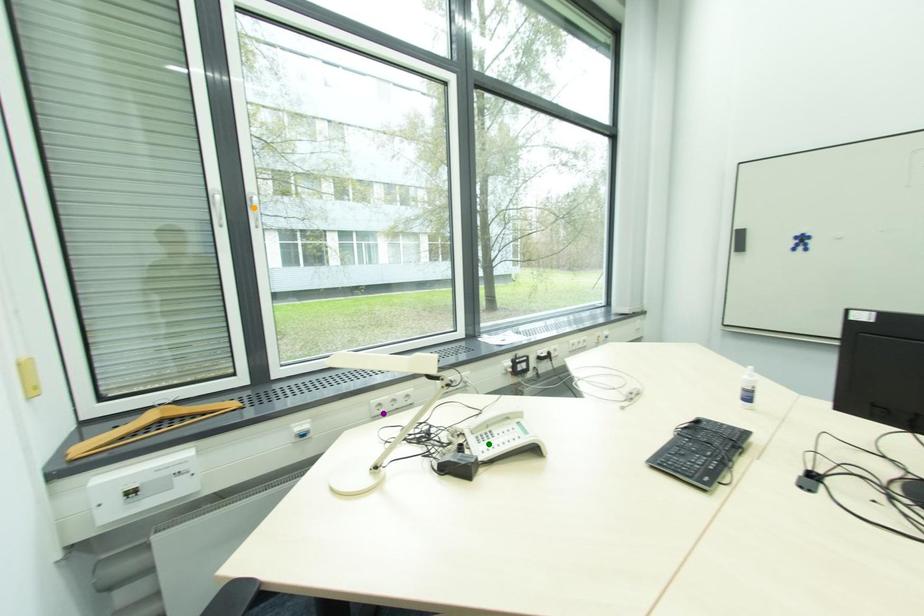
Order these from nearest to farthest:
- orange point
- green point
- purple point

1. orange point
2. green point
3. purple point